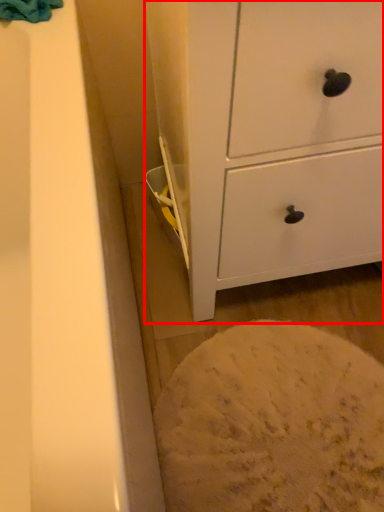
Question: From the image's perspective, where is chest of drawers (annotated by the red box) located relative to bath towel?

Choices:
 (A) below
 (B) above

Answer: (A)